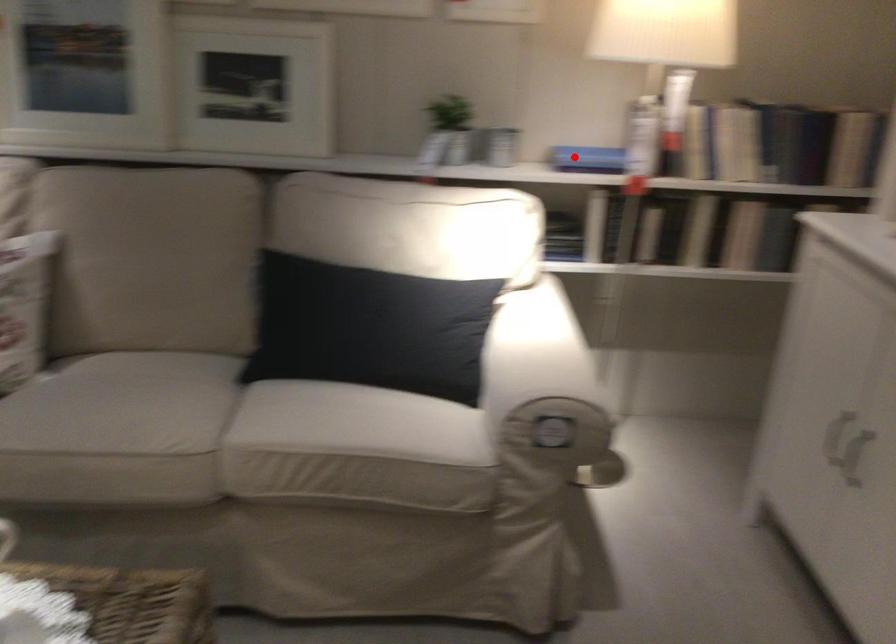
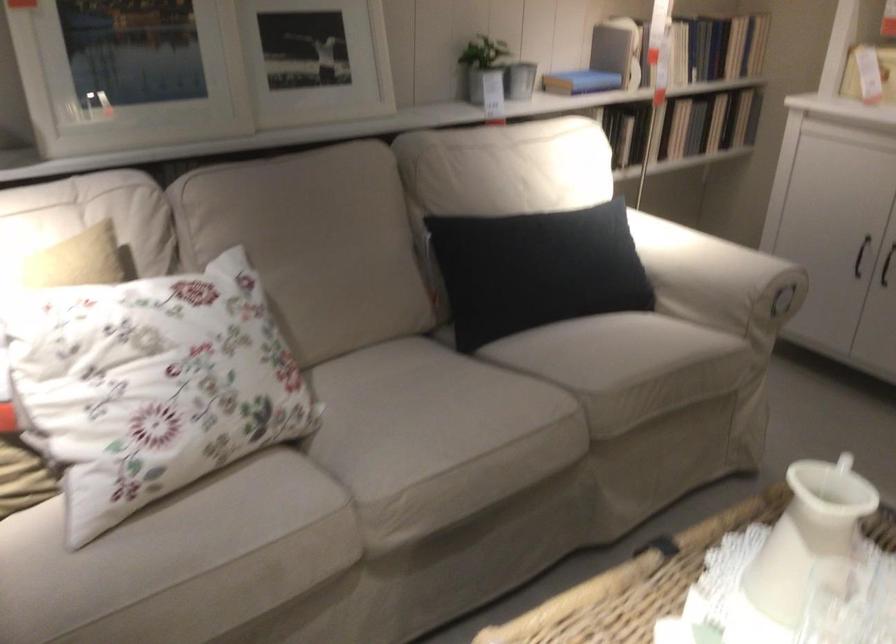
Question: I am providing you with two images of the same scene from different viewpoints. Image1 has a red point marked. In image2, the corresponding 3D location appears at what relative position? Reply with the corresponding letter.

Choices:
 (A) Closer
 (B) Farther

Answer: (B)